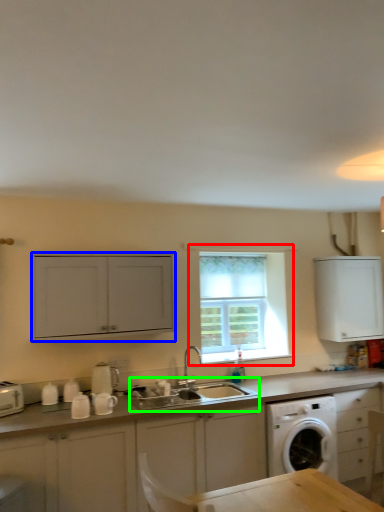
Question: Which object is positioned closest to window (highlighted by a red box)? Select from cabinetry (highlighted by a blue box) and sink (highlighted by a green box).

Choices:
 (A) cabinetry
 (B) sink

Answer: (B)